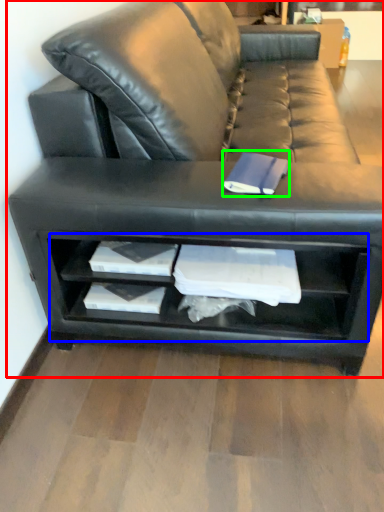
Question: Which object is positioned closest to studio couch (highlighted by a red box)? Select from shelf (highlighted by a blue box) and paperback book (highlighted by a green box).

Choices:
 (A) shelf
 (B) paperback book

Answer: (A)